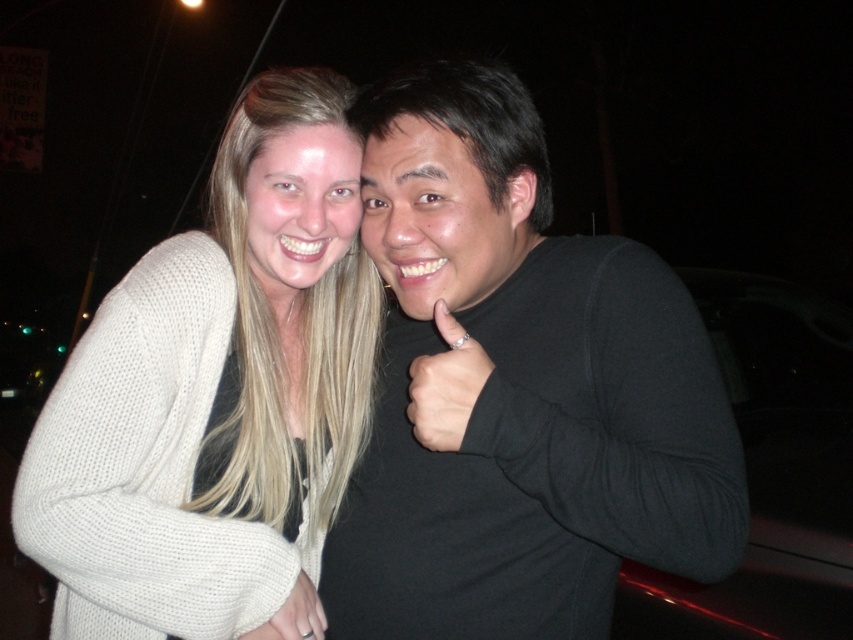
Between point (310, 204) and point (416, 381), which one is positioned in front?

Point (416, 381) is more forward.

You are a GUI agent. You are given a task and a screenshot of the screen. Output one action in this format:
    pyautogui.click(x=<x>, y=<y>)
    Task: Click on the white knitted cardigan at upper left
    This screenshot has width=853, height=640.
    Given the screenshot: What is the action you would take?
    pyautogui.click(x=218, y=396)

Which is more to the left, black matte turtleneck at center or black matte hand at center?

Positioned to the left is black matte hand at center.

Is black matte turtleneck at center positioned at the back of black matte hand at center?

No, black matte turtleneck at center is closer to the viewer.

This screenshot has width=853, height=640. Describe the element at coordinates (517, 390) in the screenshot. I see `black matte turtleneck at center` at that location.

Identify the location of black matte turtleneck at center. The image size is (853, 640). (517, 390).

Who is lower down, black matte turtleneck at center or white knitted cardigan at upper left?

white knitted cardigan at upper left is lower down.

Is point (622, 540) behind point (67, 593)?

That is False.

Locate an element on the screen. black matte turtleneck at center is located at coordinates (517, 390).